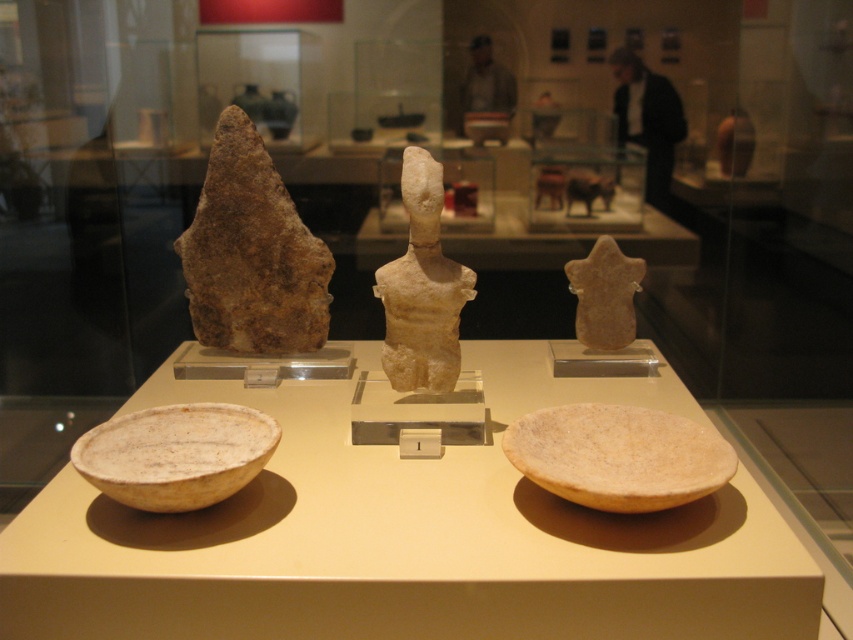
Does white stone figure at center have a lesser width compared to smooth beige stone star at center?

In fact, white stone figure at center might be wider than smooth beige stone star at center.

Is point (426, 246) closer to viewer compared to point (590, 273)?

Yes.

Does point (428, 173) come in front of point (624, 280)?

That is True.

Image resolution: width=853 pixels, height=640 pixels. I want to click on white stone figure at center, so click(x=422, y=289).

Describe the element at coordinates (177, 454) in the screenshot. I see `white matte bowl at lower left` at that location.

What do you see at coordinates (177, 454) in the screenshot? This screenshot has height=640, width=853. I see `white matte bowl at lower left` at bounding box center [177, 454].

Find the location of `white matte bowl at lower left`. white matte bowl at lower left is located at coordinates (177, 454).

Is the position of matte beige bowl at lower center less distant than that of white matte bowl at lower left?

Yes, matte beige bowl at lower center is closer to the viewer.

Measure the distance from matte beige bowl at lower center to white matte bowl at lower left.

matte beige bowl at lower center is 25.29 inches away from white matte bowl at lower left.

Is point (674, 500) closer to camera compared to point (85, 461)?

Yes, it is in front of point (85, 461).

This screenshot has height=640, width=853. What are the coordinates of `matte beige bowl at lower center` in the screenshot? It's located at (618, 456).